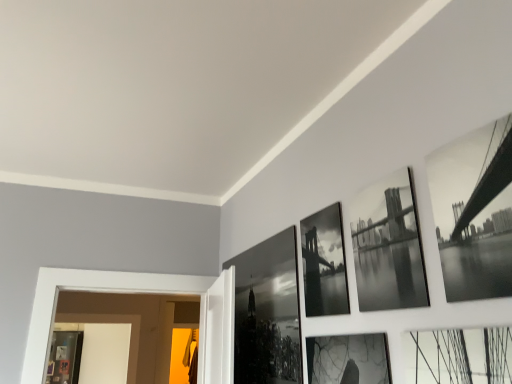
Question: Is black glossy photo frame at upper center, the second picture frame viewed from the front, smaller than black glossy bridge at upper right, the fourth picture frame when ordered from back to front?

Choices:
 (A) no
 (B) yes

Answer: (A)

Question: Does black glossy photo frame at upper center, the second picture frame viewed from the front, lie behind black glossy bridge at upper right, arranged as the fourth picture frame when viewed from the left?

Choices:
 (A) no
 (B) yes

Answer: (B)

Question: Is black glossy photo frame at upper center, which is counted as the third picture frame, starting from the back, facing away from black glossy bridge at upper right, arranged as the fourth picture frame when viewed from the left?

Choices:
 (A) no
 (B) yes

Answer: (A)

Question: Does black glossy photo frame at upper center, positioned as the 3th picture frame in left-to-right order, contain black glossy bridge at upper right, arranged as the fourth picture frame when viewed from the left?

Choices:
 (A) no
 (B) yes

Answer: (A)

Question: Is black glossy photo frame at upper center, the 2th picture frame positioned from the right, shorter than black glossy bridge at upper right, acting as the first picture frame starting from the right?

Choices:
 (A) no
 (B) yes

Answer: (A)

Question: In terms of width, does black glossy bridge at upper right, which is the first picture frame in front-to-back order, look wider or thinner when compared to black glossy photo frame at center, arranged as the first picture frame when viewed from the back?

Choices:
 (A) wide
 (B) thin

Answer: (A)

Question: Considering the relative positions of black glossy bridge at upper right, the fourth picture frame when ordered from back to front, and black glossy photo frame at center, arranged as the first picture frame when viewed from the back, in the image provided, is black glossy bridge at upper right, the fourth picture frame when ordered from back to front, to the left or to the right of black glossy photo frame at center, arranged as the first picture frame when viewed from the back,?

Choices:
 (A) left
 (B) right

Answer: (B)

Question: From the image's perspective, is black glossy bridge at upper right, acting as the first picture frame starting from the right, located above or below black glossy photo frame at center, the 4th picture frame when ordered from right to left?

Choices:
 (A) below
 (B) above

Answer: (B)

Question: In terms of height, does black glossy bridge at upper right, the fourth picture frame when ordered from back to front, look taller or shorter compared to black glossy photo frame at center, arranged as the first picture frame when viewed from the back?

Choices:
 (A) short
 (B) tall

Answer: (A)

Question: From their relative heights in the image, would you say black glossy photo frame at center, the 4th picture frame when ordered from right to left, is taller or shorter than black glossy photo frame at upper center, the second picture frame viewed from the front?

Choices:
 (A) short
 (B) tall

Answer: (B)

Question: From a real-world perspective, is black glossy photo frame at center, arranged as the fourth picture frame when viewed from the front, physically located above or below black glossy photo frame at upper center, which is counted as the third picture frame, starting from the back?

Choices:
 (A) above
 (B) below

Answer: (B)

Question: Is point (280, 269) positioned closer to the camera than point (415, 284)?

Choices:
 (A) farther
 (B) closer

Answer: (A)

Question: From the image's perspective, is black glossy photo frame at center, acting as the 1th picture frame starting from the left, above or below black glossy photo frame at upper center, which is counted as the third picture frame, starting from the back?

Choices:
 (A) above
 (B) below

Answer: (B)

Question: Is black glossy photo frame at center, the 2th picture frame in the left-to-right sequence, taller or shorter than black glossy photo frame at upper center, the second picture frame viewed from the front?

Choices:
 (A) tall
 (B) short

Answer: (A)

Question: Is black glossy photo frame at center, which appears as the third picture frame when viewed from the front, situated inside black glossy photo frame at upper center, positioned as the 3th picture frame in left-to-right order, or outside?

Choices:
 (A) inside
 (B) outside

Answer: (B)